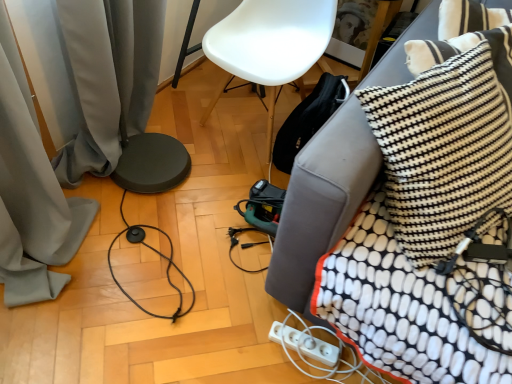
This screenshot has width=512, height=384. I want to click on empty space that is in between gray fabric curtain at lower left and white plastic chair at center, so 215,155.